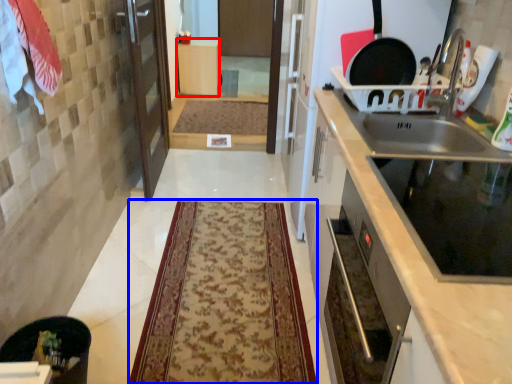
Question: Among these objects, which one is nearest to the camera, cabinetry (highlighted by a red box) or mat (highlighted by a blue box)?

Choices:
 (A) cabinetry
 (B) mat

Answer: (B)